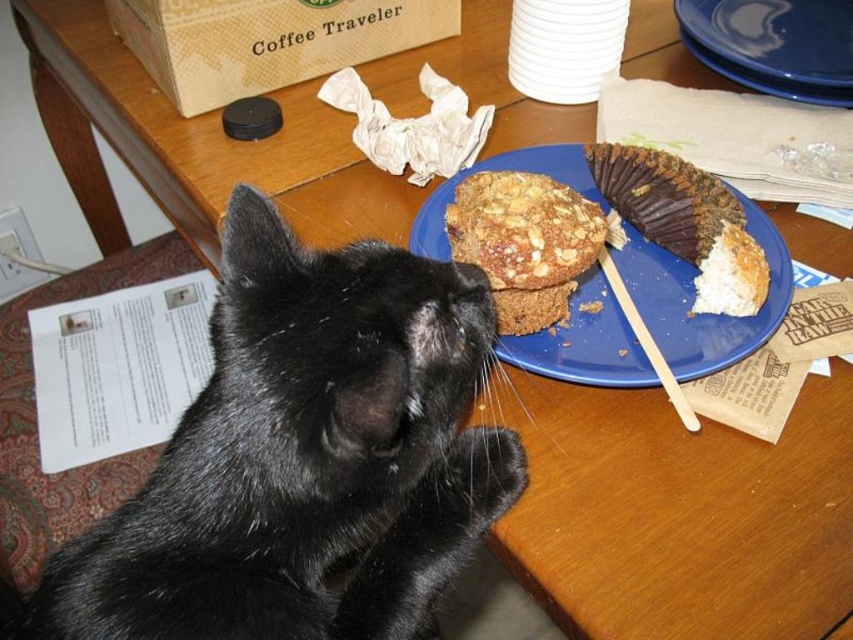
Which is behind, point (699, 352) or point (788, 20)?

Point (788, 20)

Identify the location of blue matte plate at upper right. (693, 298).

The width and height of the screenshot is (853, 640). I want to click on blue matte plate at upper right, so click(693, 298).

Can you confirm if golden brown crumbly muffin at center is positioned to the right of blue ceramic plate at upper center?

No, golden brown crumbly muffin at center is not to the right of blue ceramic plate at upper center.

Who is taller, golden brown crumbly muffin at center or blue ceramic plate at upper center?

blue ceramic plate at upper center

Does point (554, 188) lie behind point (788, 70)?

No, (554, 188) is closer to viewer.

The width and height of the screenshot is (853, 640). I want to click on golden brown crumbly muffin at center, so click(525, 243).

From the picture: Is blue matte plate at upper right thinner than golden brown crumbly muffin at center?

In fact, blue matte plate at upper right might be wider than golden brown crumbly muffin at center.

This screenshot has height=640, width=853. Describe the element at coordinates (693, 298) in the screenshot. I see `blue matte plate at upper right` at that location.

Identify the location of blue matte plate at upper right. This screenshot has width=853, height=640. (693, 298).